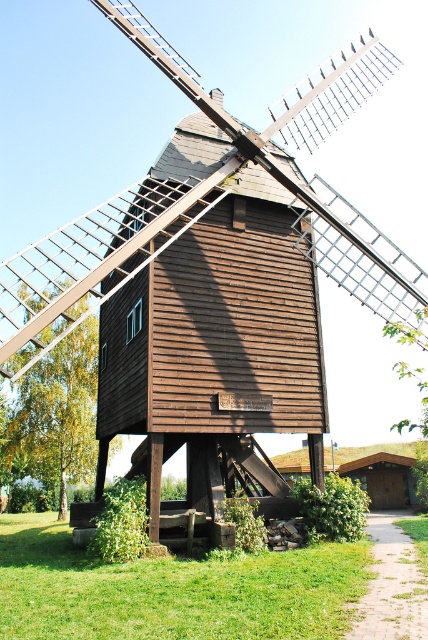
How far apart are green grass at lower center and brown wooden hut at lower right?

green grass at lower center and brown wooden hut at lower right are 22.63 meters apart.

Which is in front, point (124, 589) or point (374, 465)?

Point (124, 589)

Is point (291, 564) positioned behind point (389, 506)?

No.

Image resolution: width=428 pixels, height=640 pixels. I want to click on green grass at lower center, so click(x=172, y=589).

Who is higher up, brown wooden hut at center or brown wooden windmill at center?

brown wooden windmill at center is higher up.

Who is positioned more to the left, brown wooden hut at center or brown wooden windmill at center?

From the viewer's perspective, brown wooden windmill at center appears more on the left side.

From the picture: Who is more forward, (x=207, y=292) or (x=305, y=81)?

Positioned in front is point (x=207, y=292).

Locate an element on the screen. Image resolution: width=428 pixels, height=640 pixels. brown wooden hut at center is located at coordinates (213, 356).

At what (x,y) coordinates should I click in order to perform the action: click on brown wooden hut at center. Please return your answer as a coordinate pair (x, y). The height and width of the screenshot is (640, 428). Looking at the image, I should click on (213, 356).

The height and width of the screenshot is (640, 428). Describe the element at coordinates (213, 356) in the screenshot. I see `brown wooden hut at center` at that location.

The image size is (428, 640). What do you see at coordinates (213, 356) in the screenshot?
I see `brown wooden hut at center` at bounding box center [213, 356].

The width and height of the screenshot is (428, 640). I want to click on brown wooden hut at center, so click(213, 356).